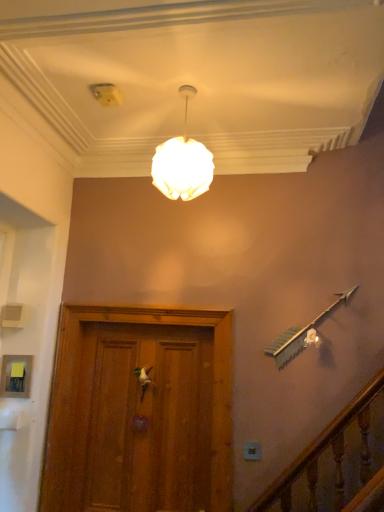
Question: Based on their positions, is white matte door handle at center located to the left or right of white plastic electric outlet at lower center?

Choices:
 (A) left
 (B) right

Answer: (A)

Question: Considering the positions of white matte door handle at center and white plastic electric outlet at lower center in the image, is white matte door handle at center taller or shorter than white plastic electric outlet at lower center?

Choices:
 (A) tall
 (B) short

Answer: (A)

Question: Estimate the real-world distances between objects in this image. Which object is closer to the white matte door handle at center?

Choices:
 (A) white matte sphere at upper center
 (B) white plastic electric outlet at lower center

Answer: (B)

Question: Estimate the real-world distances between objects in this image. Which object is closer to the white matte door handle at center?

Choices:
 (A) white matte sphere at upper center
 (B) white plastic electric outlet at lower center

Answer: (B)